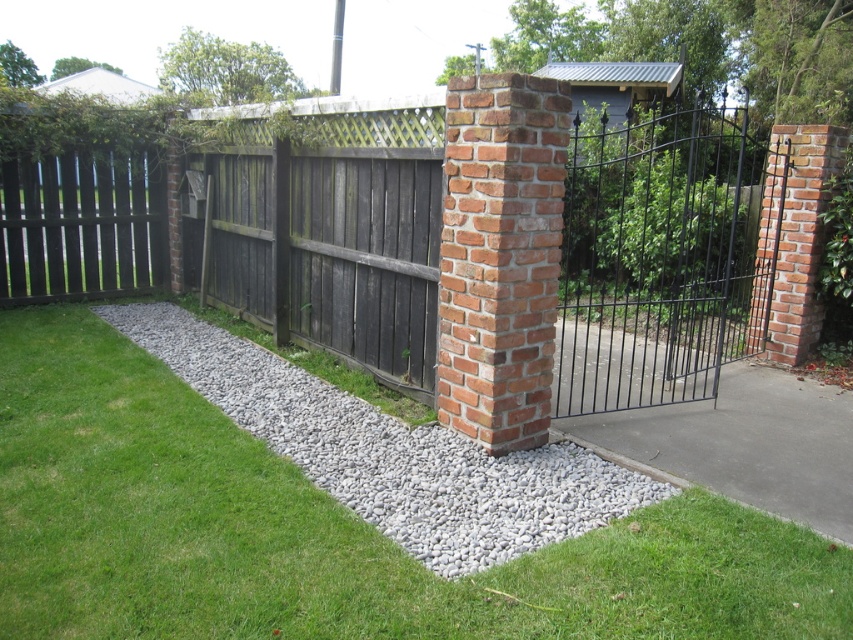
Does wooden fence at center appear on the left side of red brick column at center?

Incorrect, wooden fence at center is not on the left side of red brick column at center.

Does wooden fence at center appear over red brick column at center?

Yes, wooden fence at center is above red brick column at center.

From the picture: Who is more forward, (321, 218) or (451, 228)?

Positioned in front is point (451, 228).

Where is `wooden fence at center`? wooden fence at center is located at coordinates (662, 257).

Is wooden fence at center closer to the viewer compared to gray gravel at center?

No, it is not.

Can you confirm if wooden fence at center is positioned above gray gravel at center?

Yes.

At what (x,y) coordinates should I click in order to perform the action: click on wooden fence at center. Please return your answer as a coordinate pair (x, y). The image size is (853, 640). Looking at the image, I should click on (662, 257).

In the scene shown: Who is shorter, gray gravel at center or red brick column at center?

With less height is gray gravel at center.

From the picture: Can you confirm if gray gravel at center is taller than red brick column at center?

In fact, gray gravel at center may be shorter than red brick column at center.

Identify the location of gray gravel at center. (392, 452).

Locate an element on the screen. gray gravel at center is located at coordinates (392, 452).